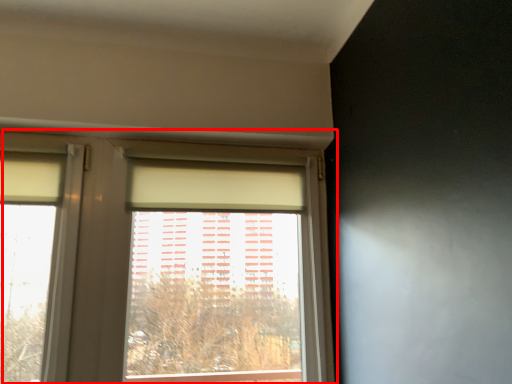
Question: From the image's perspective, considering the relative positions of window (annotated by the red box) and curtain in the image provided, where is window (annotated by the red box) located with respect to the staircase?

Choices:
 (A) below
 (B) above

Answer: (A)